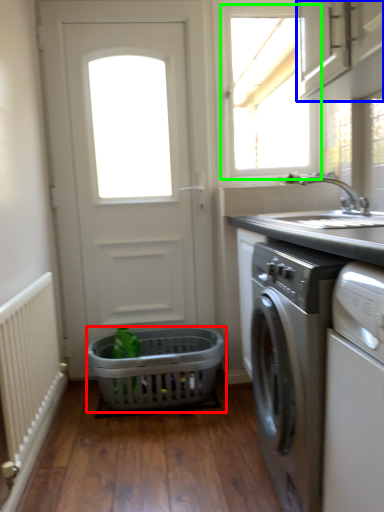
Question: Based on their relative distances, which object is farther from basket (highlighted by a red box)? Choose from cabinetry (highlighted by a blue box) and window (highlighted by a green box).

Choices:
 (A) cabinetry
 (B) window

Answer: (B)